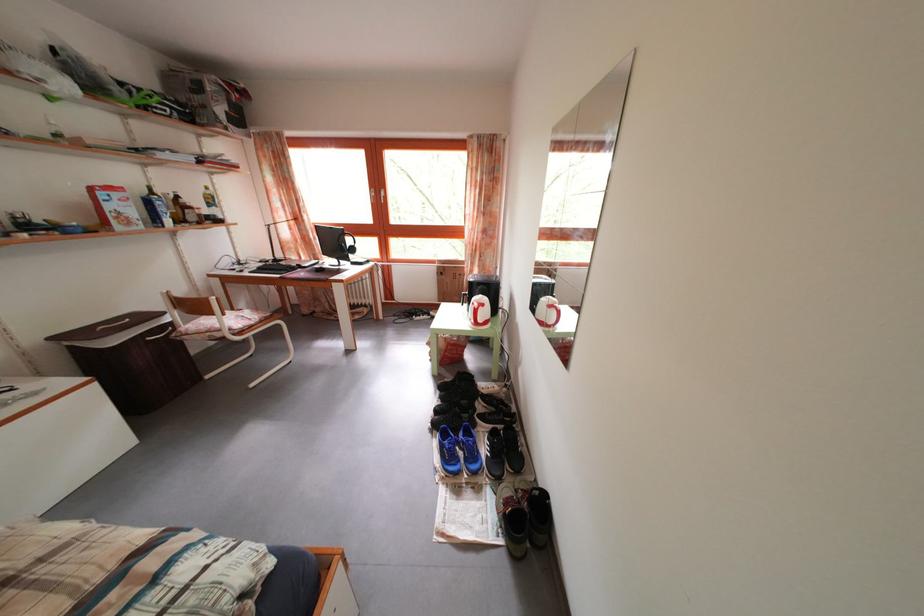
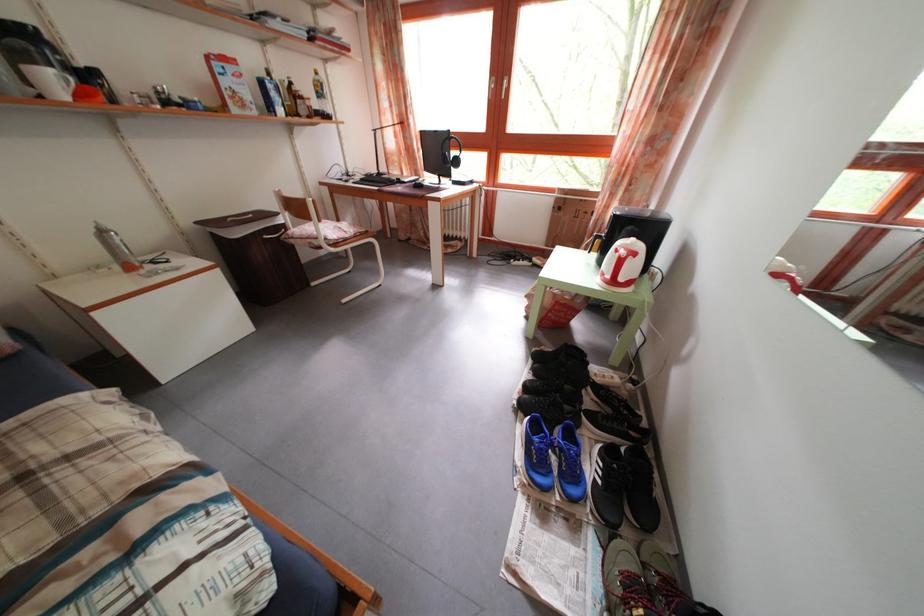
The point at (214,196) is marked in the first image. Where is the corresponding point in the second image?

(323, 79)